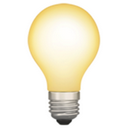
The width and height of the screenshot is (128, 128). I want to click on light bulb, so click(x=61, y=70).